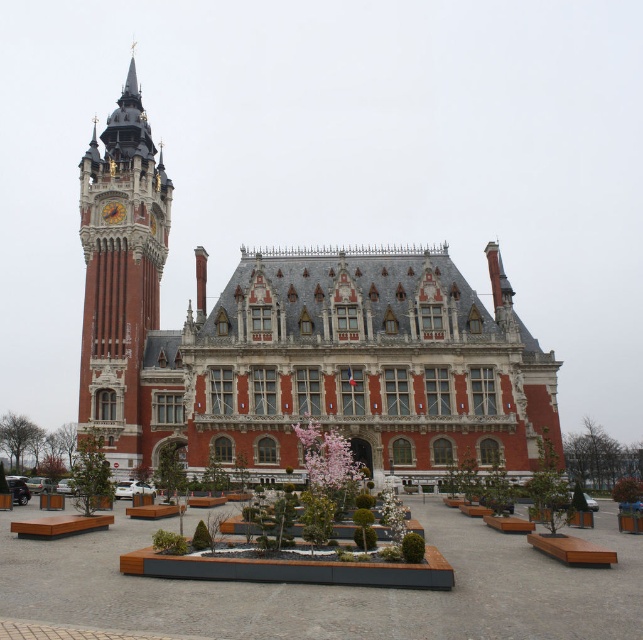
You are a city planner assessing the space in front of the red brick palace at center and the red brick clock tower at left. Based on their widths, which structure would require more horizontal space for renovations or expansions?

The red brick palace at center might require more horizontal space for renovations or expansions since it is possibly wider than the red brick clock tower at left according to the description.

You are standing in front of the grand historic building and want to take a photo that includes the red brick palace at center. Based on the building layout, where should you position yourself to ensure the palace is centered in your photo?

The red brick palace at center is located at point coordinates approximately 0.539 on the x axis and 0.459 on the y axis. To center it in your photo, position yourself so the camera is aligned with these coordinates.